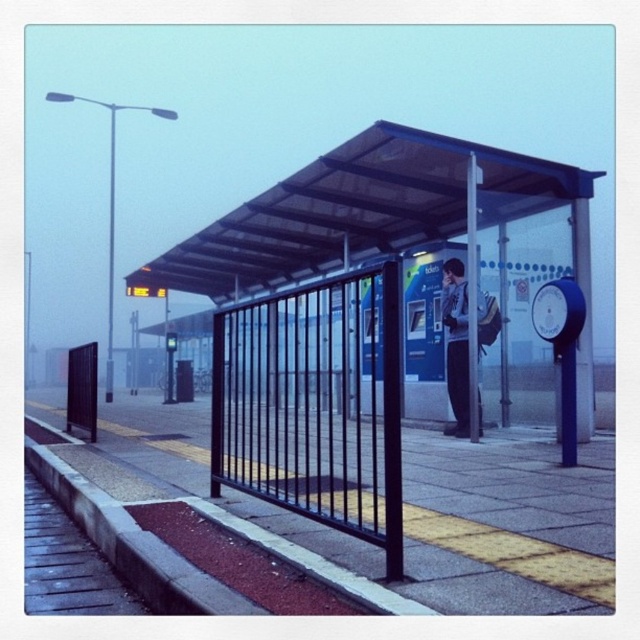
You are a maintenance worker at the station and need to replace a part that requires a space of at least 1.5 meters in width. You see the transparent plastic bus station at center and the metallic pole at center. Which object can you work on without needing to move anything else?

The transparent plastic bus station at center is bigger than metallic pole at center, so you can work on the transparent plastic bus station at center since it likely has enough space for the maintenance work requiring 1.5 meters in width.

You are a delivery person carrying a large box that is 3 meters long. You need to walk from the camera to the transparent plastic bus station at center. Is there enough space for you to pass through the area between them?

The distance between the transparent plastic bus station at center and the camera is 3.19 meters. Since the box is 3 meters long, there is enough space for the delivery person to pass through the area between them.